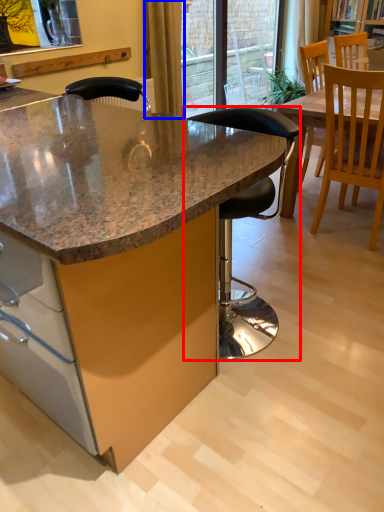
Question: Which point is further to the camera, chair (highlighted by a red box) or curtain (highlighted by a blue box)?

Choices:
 (A) chair
 (B) curtain

Answer: (B)